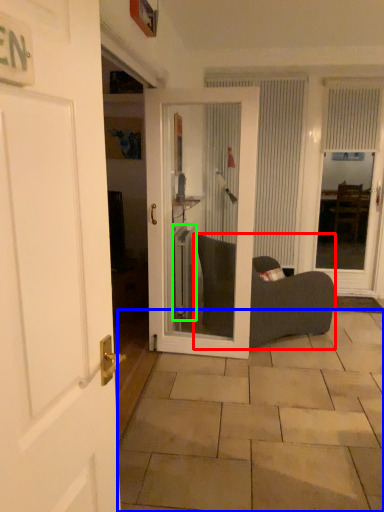
Question: Which is farther away from furniture (highlighted by a red box)? tile (highlighted by a blue box) or radiator (highlighted by a green box)?

Choices:
 (A) tile
 (B) radiator

Answer: (A)